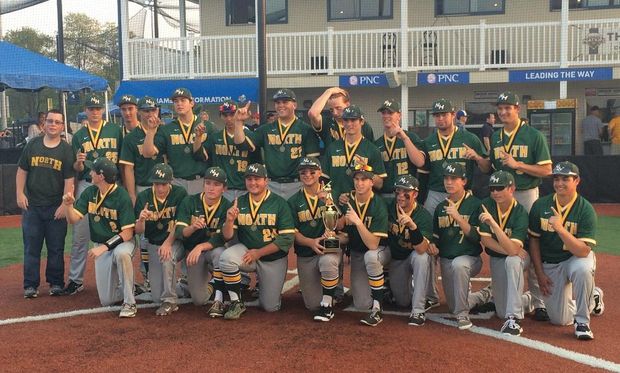
Image resolution: width=620 pixels, height=373 pixels. I want to click on trophy, so click(329, 225).